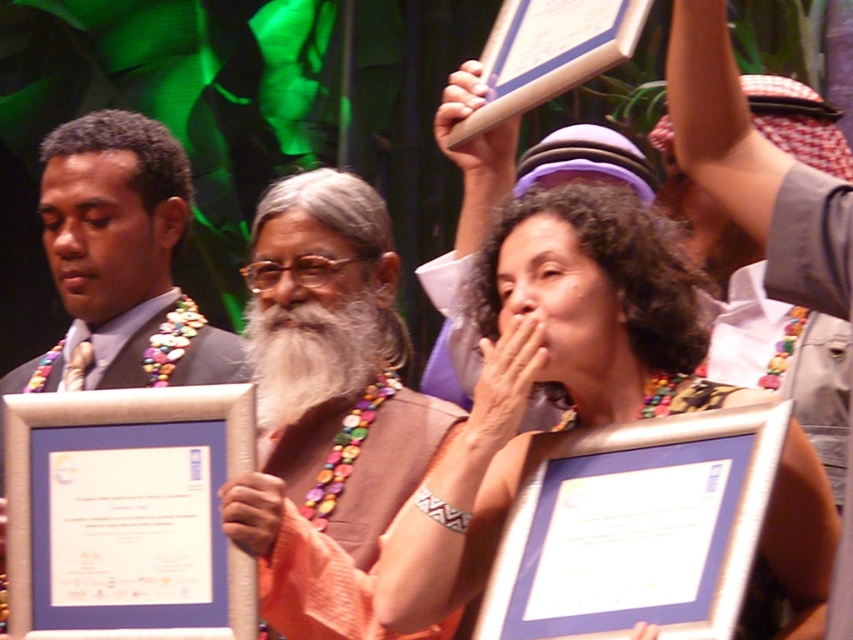
Question: Does multicolored beaded necklace at center appear on the right side of white paper at center?

Choices:
 (A) yes
 (B) no

Answer: (A)

Question: Does multicolored beaded necklace at center appear on the left side of brown fabric at center?

Choices:
 (A) no
 (B) yes

Answer: (A)

Question: Which object appears farthest from the camera in this image?

Choices:
 (A) multicolored beaded necklace at center
 (B) matte silver frame at lower center
 (C) white paper at center
 (D) brown fabric at center

Answer: (D)

Question: Among these points, which one is nearest to the camera?

Choices:
 (A) (822, 492)
 (B) (683, 413)
 (C) (228, 547)

Answer: (A)

Question: Estimate the real-world distances between objects in this image. Which object is farther from the brown fabric at center?

Choices:
 (A) multicolored beaded necklace at center
 (B) matte silver frame at lower center

Answer: (B)

Question: Can you confirm if multicolored beaded necklace at center is wider than matte silver frame at lower center?

Choices:
 (A) no
 (B) yes

Answer: (B)